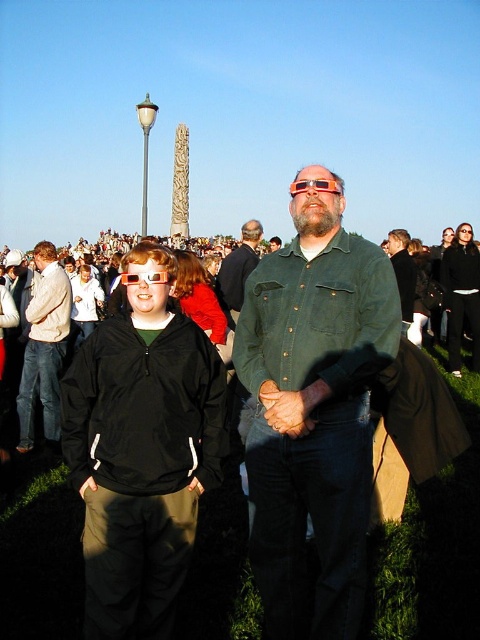
Question: Which object is positioned closest to the translucent orange goggles at center?

Choices:
 (A) green matte shirt at center
 (B) matte black jacket at center
 (C) red plastic glasses at center
 (D) matte black jacket at left

Answer: (C)

Question: Is green denim shirt at center closer to the viewer compared to matte black jacket at center?

Choices:
 (A) no
 (B) yes

Answer: (A)

Question: Which object is positioned farthest from the red fabric jacket at center?

Choices:
 (A) black leather jacket at center
 (B) matte black jacket at left
 (C) green matte shirt at center

Answer: (A)

Question: Is green denim shirt at center above black leather jacket at center?

Choices:
 (A) yes
 (B) no

Answer: (B)

Question: Can you confirm if green denim shirt at center is smaller than green matte shirt at center?

Choices:
 (A) no
 (B) yes

Answer: (A)

Question: Which point is closer to the camera taking this photo?

Choices:
 (A) (99, 465)
 (B) (17, 394)
 (C) (299, 182)

Answer: (A)